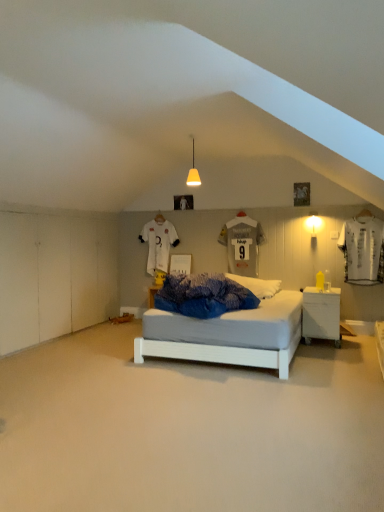
This screenshot has height=512, width=384. Describe the element at coordinates (242, 244) in the screenshot. I see `gray matte jersey at center, arranged as the second t shirt when viewed from the back` at that location.

Locate an element on the screen. The width and height of the screenshot is (384, 512). matte yellow pendant at center, the first light fixture from the top is located at coordinates (193, 174).

Describe the element at coordinates (193, 174) in the screenshot. I see `matte yellow pendant at center, positioned as the 2th light fixture in back-to-front order` at that location.

The width and height of the screenshot is (384, 512). What are the coordinates of `white soft pillow at center` in the screenshot? It's located at (257, 285).

What do you see at coordinates (159, 243) in the screenshot? I see `white jersey at upper center, positioned as the first t shirt in left-to-right order` at bounding box center [159, 243].

Image resolution: width=384 pixels, height=512 pixels. Identify the location of white smooth floor at center. (189, 429).

From the image's perspective, is matte yellow pendant at center, which is the 2th light fixture from right to left, located above or below gray matte jersey at center, the first t shirt in the right-to-left sequence?

Clearly, from the image's perspective, matte yellow pendant at center, which is the 2th light fixture from right to left, is above gray matte jersey at center, the first t shirt in the right-to-left sequence.

In the scene shown: How far apart are matte yellow pendant at center, positioned as the 2th light fixture in back-to-front order, and gray matte jersey at center, arranged as the second t shirt when viewed from the back?

Answer: matte yellow pendant at center, positioned as the 2th light fixture in back-to-front order, is 1.16 meters away from gray matte jersey at center, arranged as the second t shirt when viewed from the back.

Is matte yellow pendant at center, which is the 2th light fixture from right to left, at the left side of gray matte jersey at center, the first t shirt in the right-to-left sequence?

Correct, you'll find matte yellow pendant at center, which is the 2th light fixture from right to left, to the left of gray matte jersey at center, the first t shirt in the right-to-left sequence.

Is matte yellow pendant at center, the first light fixture viewed from the front, oriented away from gray matte jersey at center, which is the 2th t shirt in left-to-right order?

Absolutely, matte yellow pendant at center, the first light fixture viewed from the front, is directed away from gray matte jersey at center, which is the 2th t shirt in left-to-right order.

Would you say white jersey at upper center, positioned as the first t shirt in left-to-right order, is outside white glossy nightstand at lower right?

Indeed, white jersey at upper center, positioned as the first t shirt in left-to-right order, is completely outside white glossy nightstand at lower right.

From the image's perspective, which is above, white jersey at upper center, which is counted as the first t shirt, starting from the back, or white glossy nightstand at lower right?

white jersey at upper center, which is counted as the first t shirt, starting from the back.

Is white jersey at upper center, the 2th t shirt when ordered from front to back, looking in the opposite direction of white glossy nightstand at lower right?

No, white glossy nightstand at lower right is not at the back of white jersey at upper center, the 2th t shirt when ordered from front to back.

Which is more distant, (150, 261) or (313, 328)?

The point (150, 261) is farther.

Is gray matte jersey at center, the 1th t shirt when ordered from front to back, placed right next to white soft pillow at center?

gray matte jersey at center, the 1th t shirt when ordered from front to back, and white soft pillow at center are not in contact.

Can you confirm if gray matte jersey at center, which is the 2th t shirt in left-to-right order, is taller than white soft pillow at center?

Indeed, gray matte jersey at center, which is the 2th t shirt in left-to-right order, has a greater height compared to white soft pillow at center.

Is gray matte jersey at center, arranged as the second t shirt when viewed from the back, to the right of white soft pillow at center from the viewer's perspective?

Correct, you'll find gray matte jersey at center, arranged as the second t shirt when viewed from the back, to the right of white soft pillow at center.

Does gray matte jersey at center, which is the 2th t shirt in left-to-right order, turn towards white soft pillow at center?

Yes, gray matte jersey at center, which is the 2th t shirt in left-to-right order, is aimed at white soft pillow at center.

Is white smooth floor at center positioned far away from white glossy nightstand at lower right?

That's right, there is a large distance between white smooth floor at center and white glossy nightstand at lower right.

Considering the sizes of objects white smooth floor at center and white glossy nightstand at lower right in the image provided, who is smaller, white smooth floor at center or white glossy nightstand at lower right?

white glossy nightstand at lower right.

From a real-world perspective, which object stands above the other?

From a 3D spatial view, white glossy nightstand at lower right is above.

Is white smooth floor at center positioned with its back to white glossy nightstand at lower right?

No.

Consider the image. Which of these two, gray matte jersey at center, arranged as the second t shirt when viewed from the back, or white matte wall sconce at right, acting as the first light fixture starting from the bottom, is thinner?

gray matte jersey at center, arranged as the second t shirt when viewed from the back.

Is gray matte jersey at center, which is the 2th t shirt in left-to-right order, smaller than white matte wall sconce at right, arranged as the 2th light fixture when viewed from the front?

No.

Based on the photo, relative to white matte wall sconce at right, arranged as the 2th light fixture when viewed from the front, is gray matte jersey at center, which is the 2th t shirt in left-to-right order, in front or behind?

Visually, gray matte jersey at center, which is the 2th t shirt in left-to-right order, is located behind white matte wall sconce at right, arranged as the 2th light fixture when viewed from the front.

Which is closer, [249,271] or [313,220]?

Point [249,271].

Which of these two, white jersey at upper center, the 2th t shirt when ordered from front to back, or gray matte jersey at center, which is the 2th t shirt in left-to-right order, is wider?

With larger width is white jersey at upper center, the 2th t shirt when ordered from front to back.

Looking at this image, does white jersey at upper center, which is counted as the first t shirt, starting from the back, have a lesser height compared to gray matte jersey at center, the 1th t shirt when ordered from front to back?

No, white jersey at upper center, which is counted as the first t shirt, starting from the back, is not shorter than gray matte jersey at center, the 1th t shirt when ordered from front to back.

In order to click on t shirt beneath the gray matte jersey at center, arranged as the second t shirt when viewed from the back (from a real-world perspective) in this screenshot , I will do `click(159, 243)`.

Is white jersey at upper center, the 2th t shirt when ordered from front to back, aimed at gray matte jersey at center, arranged as the second t shirt when viewed from the back?

No, white jersey at upper center, the 2th t shirt when ordered from front to back, is not aimed at gray matte jersey at center, arranged as the second t shirt when viewed from the back.

Is white soft pillow at center spatially inside white jersey at upper center, the 2th t shirt when ordered from front to back, or outside of it?

white soft pillow at center is not enclosed by white jersey at upper center, the 2th t shirt when ordered from front to back.

Between white soft pillow at center and white jersey at upper center, which is counted as the first t shirt, starting from the back, which one has larger width?

white soft pillow at center.

Is white soft pillow at center oriented away from white jersey at upper center, the 2th t shirt when ordered from front to back?

No, white soft pillow at center is not facing away from white jersey at upper center, the 2th t shirt when ordered from front to back.

Is white soft pillow at center touching white jersey at upper center, which is counted as the first t shirt, starting from the back?

No, white soft pillow at center is not in contact with white jersey at upper center, which is counted as the first t shirt, starting from the back.

The height and width of the screenshot is (512, 384). In order to click on light fixture located on the left of gray matte jersey at center, the first t shirt in the right-to-left sequence in this screenshot , I will do `click(193, 174)`.

You are a GUI agent. You are given a task and a screenshot of the screen. Output one action in this format:
    pyautogui.click(x=<x>, y=<y>)
    Task: Click on the nightstand that is below the white jersey at upper center, the 2th t shirt when ordered from front to back (from the image's perspective)
    This screenshot has width=384, height=512.
    Given the screenshot: What is the action you would take?
    pyautogui.click(x=321, y=315)

Which object lies further to the anchor point white jersey at upper center, which is counted as the first t shirt, starting from the back, matte yellow pendant at center, positioned as the 2th light fixture in back-to-front order, or white matte wall sconce at right, acting as the 2th light fixture starting from the left?

Among the two, white matte wall sconce at right, acting as the 2th light fixture starting from the left, is located further to white jersey at upper center, which is counted as the first t shirt, starting from the back.

When comparing their distances from white soft pillow at center, does white glossy nightstand at lower right or gray matte jersey at center, the 1th t shirt when ordered from front to back, seem closer?

Among the two, white glossy nightstand at lower right is located nearer to white soft pillow at center.

Based on their spatial positions, is white matte wall sconce at right, acting as the 2th light fixture starting from the left, or white glossy nightstand at lower right closer to white jersey at upper center, positioned as the first t shirt in left-to-right order?

white matte wall sconce at right, acting as the 2th light fixture starting from the left, is closer to white jersey at upper center, positioned as the first t shirt in left-to-right order.

From the image, which object appears to be farther from white glossy nightstand at lower right, gray matte jersey at center, which is the 2th t shirt in left-to-right order, or white smooth floor at center?

white smooth floor at center is positioned further to the anchor white glossy nightstand at lower right.

Looking at the image, which one is located closer to white soft pillow at center, white smooth floor at center or white jersey at upper center, the 2th t shirt when ordered from front to back?

white jersey at upper center, the 2th t shirt when ordered from front to back, lies closer to white soft pillow at center than the other object.

Looking at the image, which one is located closer to gray matte jersey at center, arranged as the second t shirt when viewed from the back, white glossy nightstand at lower right or white soft pillow at center?

The object closer to gray matte jersey at center, arranged as the second t shirt when viewed from the back, is white soft pillow at center.

When comparing their distances from white smooth floor at center, does gray matte jersey at center, which is the 2th t shirt in left-to-right order, or white jersey at upper center, which appears as the second t shirt when viewed from the right, seem closer?

gray matte jersey at center, which is the 2th t shirt in left-to-right order.

Which object lies further to the anchor point white glossy nightstand at lower right, white smooth floor at center or white soft pillow at center?

Among the two, white smooth floor at center is located further to white glossy nightstand at lower right.

You are a GUI agent. You are given a task and a screenshot of the screen. Output one action in this format:
    pyautogui.click(x=<x>, y=<y>)
    Task: Click on the t shirt situated between matte yellow pendant at center, which is the second light fixture from bottom to top, and white matte wall sconce at right, acting as the 2th light fixture starting from the left, from left to right
    The height and width of the screenshot is (512, 384).
    Given the screenshot: What is the action you would take?
    pyautogui.click(x=242, y=244)

Find the location of a particular element. Image resolution: width=384 pixels, height=512 pixels. t shirt between white jersey at upper center, which is counted as the first t shirt, starting from the back, and white glossy nightstand at lower right is located at coordinates (242, 244).

Find the location of a particular element. t shirt between matte yellow pendant at center, which is counted as the first light fixture, starting from the left, and white jersey at upper center, which appears as the second t shirt when viewed from the right, from front to back is located at coordinates (242, 244).

Where is `pillow between white smooth floor at center and white matte wall sconce at right, which ranks as the second light fixture in top-to-bottom order, from front to back`? The width and height of the screenshot is (384, 512). pillow between white smooth floor at center and white matte wall sconce at right, which ranks as the second light fixture in top-to-bottom order, from front to back is located at coordinates (257, 285).